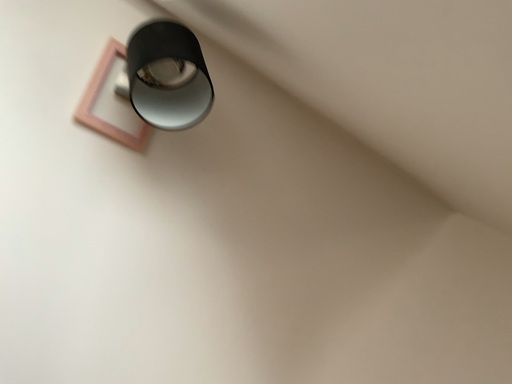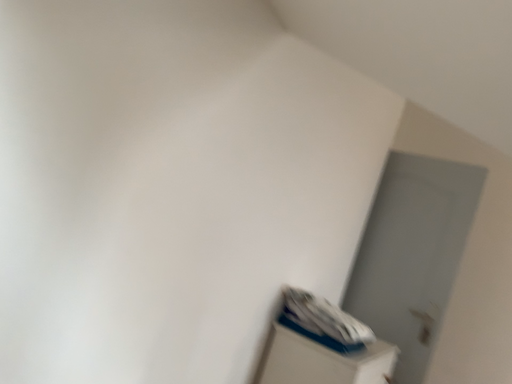
Question: Which way did the camera rotate in the video?

Choices:
 (A) rotated downward
 (B) rotated upward

Answer: (A)